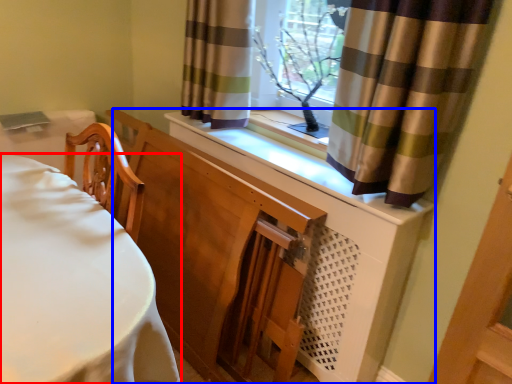
Question: Which object appears closest to the camera in this image, furniture (highlighted by a red box) or dresser (highlighted by a blue box)?

Choices:
 (A) furniture
 (B) dresser

Answer: (A)